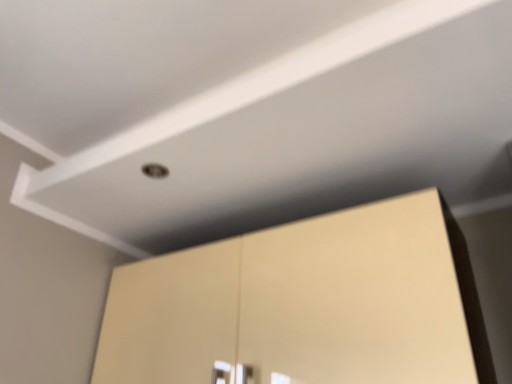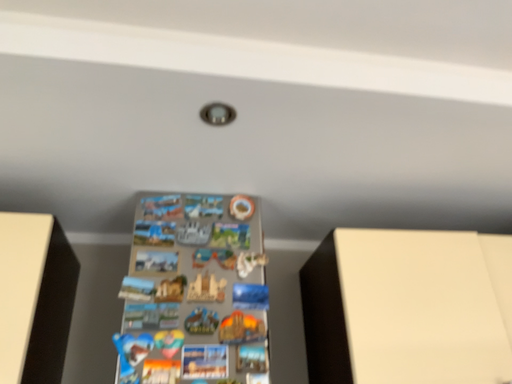
Question: How did the camera likely rotate when shooting the video?

Choices:
 (A) rotated right
 (B) rotated left

Answer: (A)